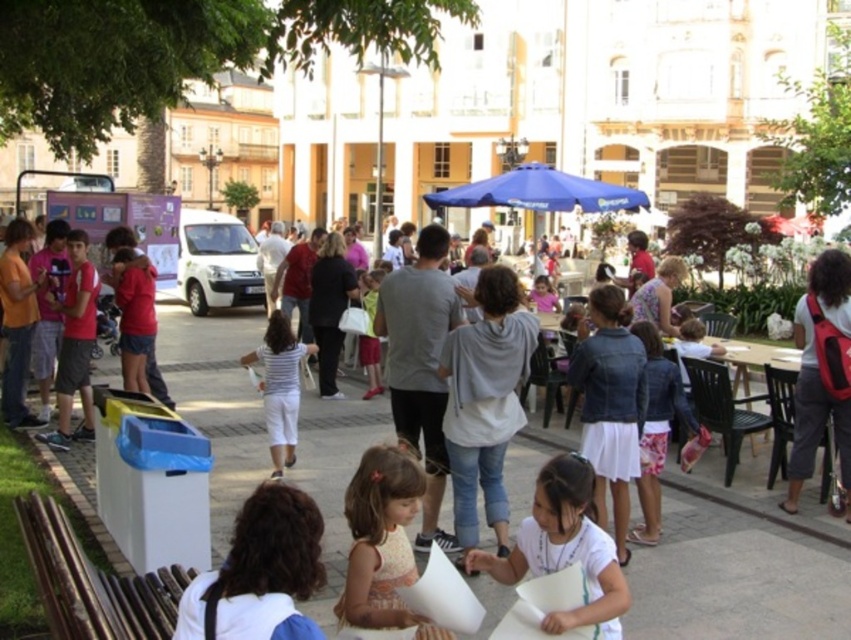
Question: Does brown wooden bench at lower left have a lesser width compared to denim jacket at center?

Choices:
 (A) no
 (B) yes

Answer: (A)

Question: Which of the following is the closest to the observer?

Choices:
 (A) brown wooden bench at lower left
 (B) denim jacket at center

Answer: (A)

Question: Among these objects, which one is farthest from the camera?

Choices:
 (A) brown wooden bench at lower left
 (B) denim jacket at center

Answer: (B)

Question: Considering the relative positions of blue fabric umbrella at center and denim jacket at center in the image provided, where is blue fabric umbrella at center located with respect to denim jacket at center?

Choices:
 (A) right
 (B) left

Answer: (B)

Question: From the image, what is the correct spatial relationship of brown wooden bench at lower left in relation to light brown fabric dress at center?

Choices:
 (A) right
 (B) left

Answer: (B)

Question: Which of the following is the closest to the observer?

Choices:
 (A) (363, 614)
 (B) (734, 634)
 (C) (670, 420)
 (D) (558, 198)

Answer: (A)